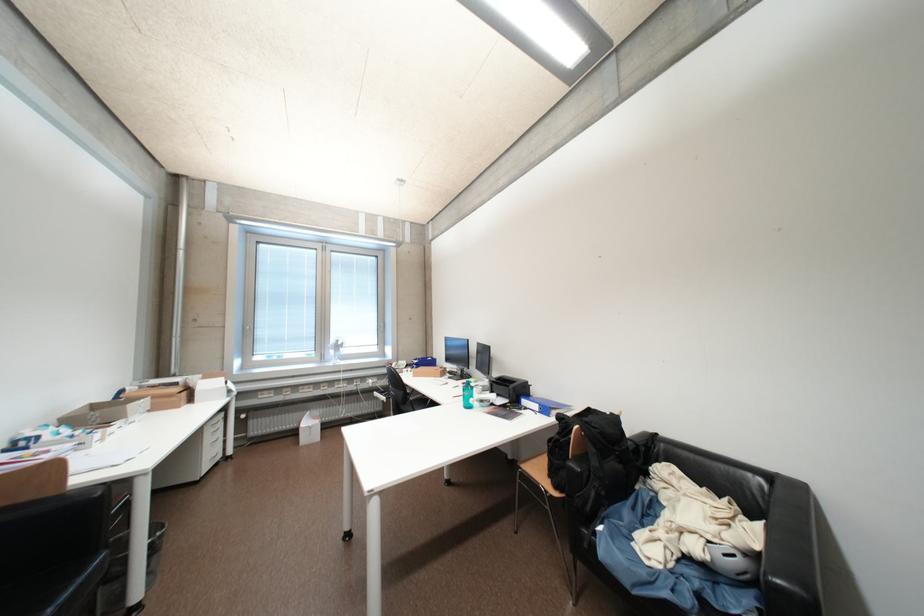
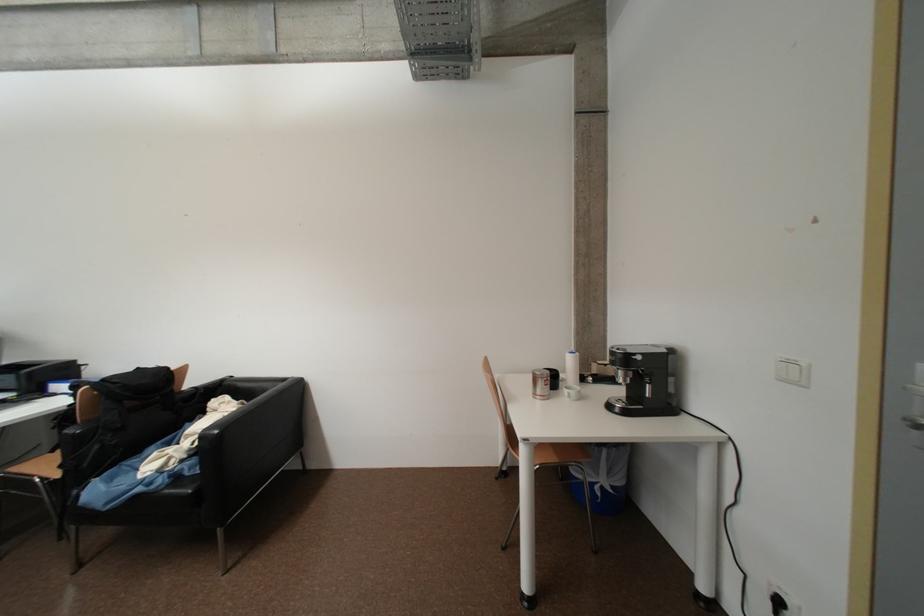
Question: I am providing you with two images of the same scene from different viewpoints. Please identify which objects are invisible in image2.

Choices:
 (A) chair sitting surface
 (B) black dropper top
 (C) silver coffee can
 (D) coffee machine handle

Answer: (A)